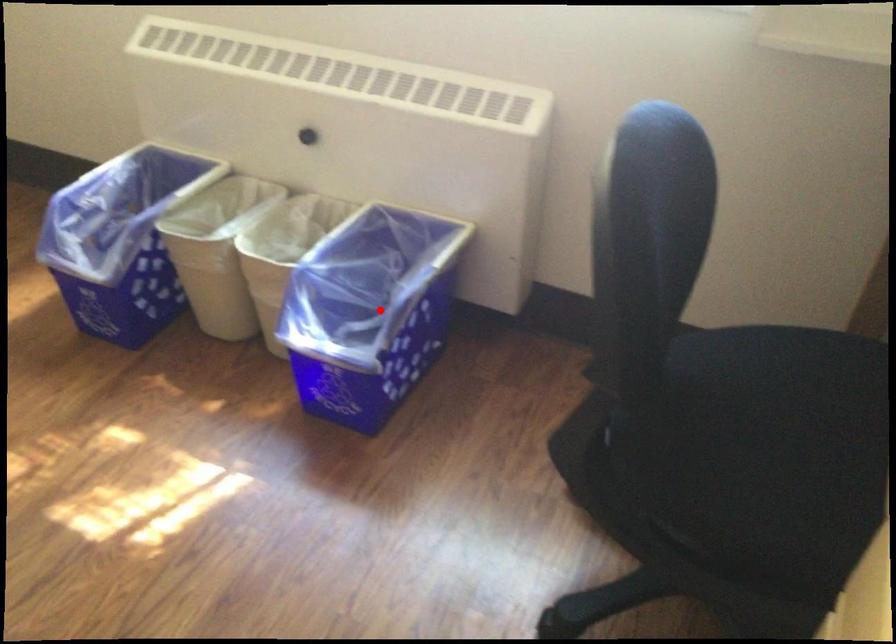
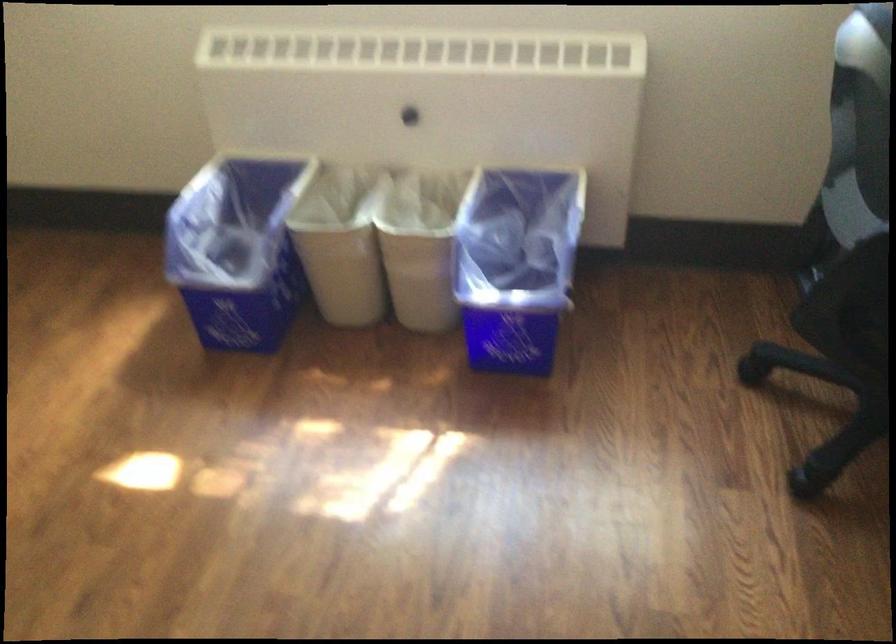
In the second image, find the point that corresponds to the highlighted location in the first image.

(515, 265)